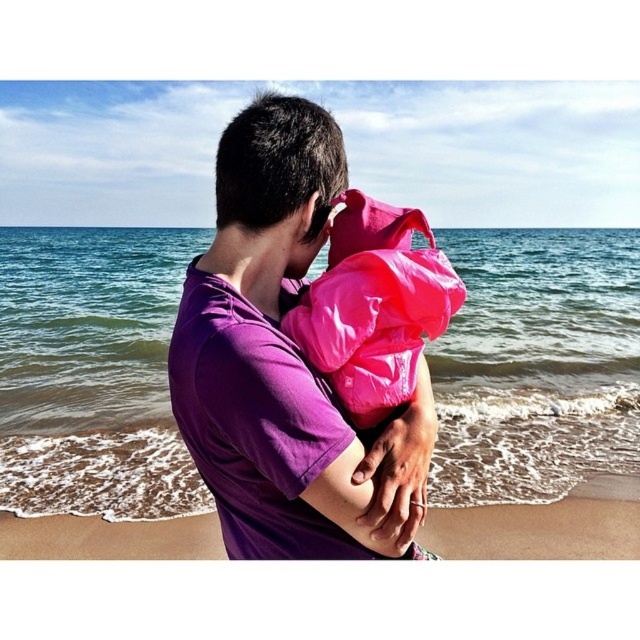
Question: From the image, what is the correct spatial relationship of purple cotton shirt at center in relation to sandy beach at lower center?

Choices:
 (A) above
 (B) below

Answer: (A)

Question: Is the position of purple cotton shirt at center less distant than that of sandy beach at lower center?

Choices:
 (A) yes
 (B) no

Answer: (A)

Question: Which object is farther from the camera taking this photo?

Choices:
 (A) sandy beach at lower center
 (B) pink fabric at center
 (C) purple cotton shirt at center

Answer: (A)

Question: Among these objects, which one is nearest to the camera?

Choices:
 (A) sandy beach at lower center
 (B) pink fabric at center

Answer: (B)

Question: Does purple cotton shirt at center have a larger size compared to sandy beach at lower center?

Choices:
 (A) no
 (B) yes

Answer: (B)

Question: Considering the real-world distances, which object is farthest from the purple cotton shirt at center?

Choices:
 (A) pink fabric at center
 (B) sandy beach at lower center

Answer: (B)